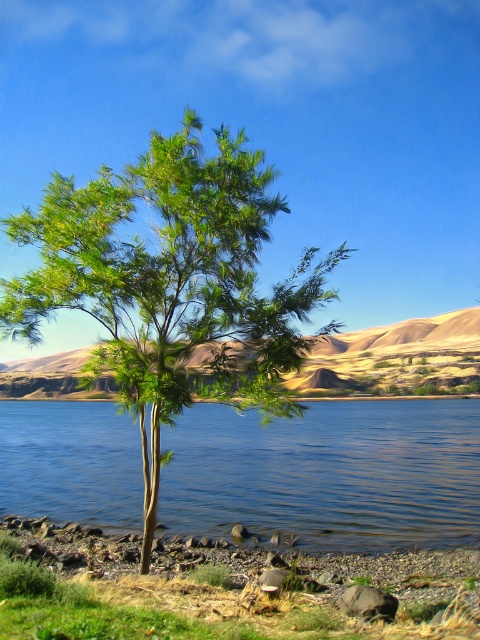
Is green leafy tree at center bigger than blue liquid water at center?

No.

Between point (225, 211) and point (380, 416), which one is positioned in front?

Point (225, 211) is in front.

Which is in front, point (277, 298) or point (354, 548)?

Point (277, 298) is more forward.

At what (x,y) coordinates should I click in order to perform the action: click on green leafy tree at center. Please return your answer as a coordinate pair (x, y). This screenshot has width=480, height=640. Looking at the image, I should click on (168, 280).